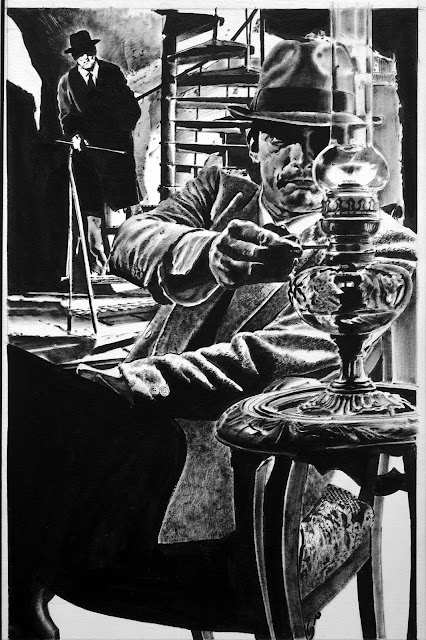
At what (x,y) coordinates should I click in order to perform the action: click on chair. Please return your answer as a coordinate pair (x, y). The image size is (426, 640). Looking at the image, I should click on 315,568.